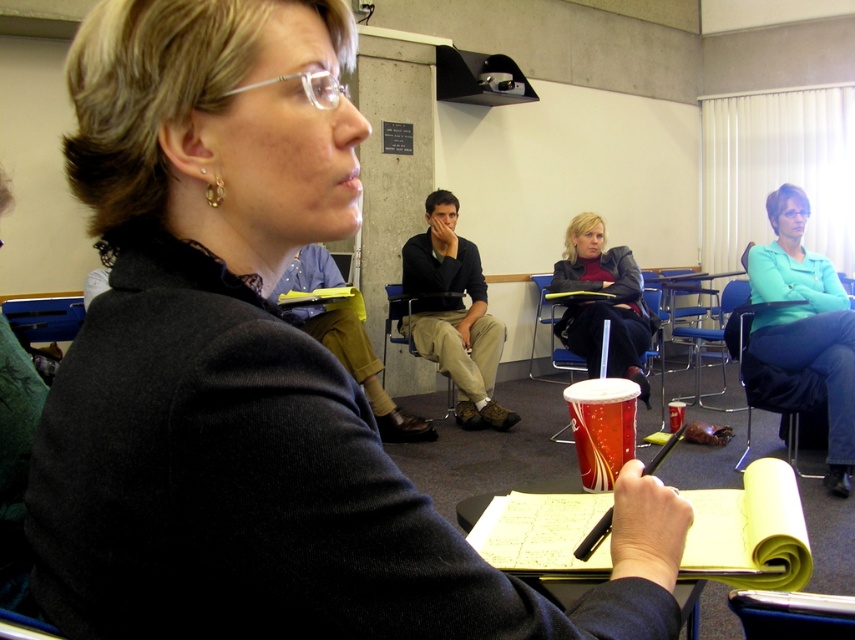
Question: Among these objects, which one is farthest from the camera?

Choices:
 (A) matte plastic chair at center
 (B) red plastic cup at center
 (C) blue fabric chair at right

Answer: (A)

Question: Is teal sweater at right thinner than shiny red cup at center?

Choices:
 (A) no
 (B) yes

Answer: (A)

Question: Which of the following is the farthest from the observer?

Choices:
 (A) (593, 429)
 (B) (603, 372)
 (C) (593, 225)
 (D) (746, 333)

Answer: (C)

Question: Is blue fabric chair at right above matte plastic chair at center?

Choices:
 (A) no
 (B) yes

Answer: (A)

Question: Where is matte black jacket at center located in relation to matte plastic chair at center in the image?

Choices:
 (A) right
 (B) left

Answer: (A)

Question: Considering the real-world distances, which object is closest to the matte black jacket at center?

Choices:
 (A) dark brown pants at center
 (B) matte plastic chair at center

Answer: (A)